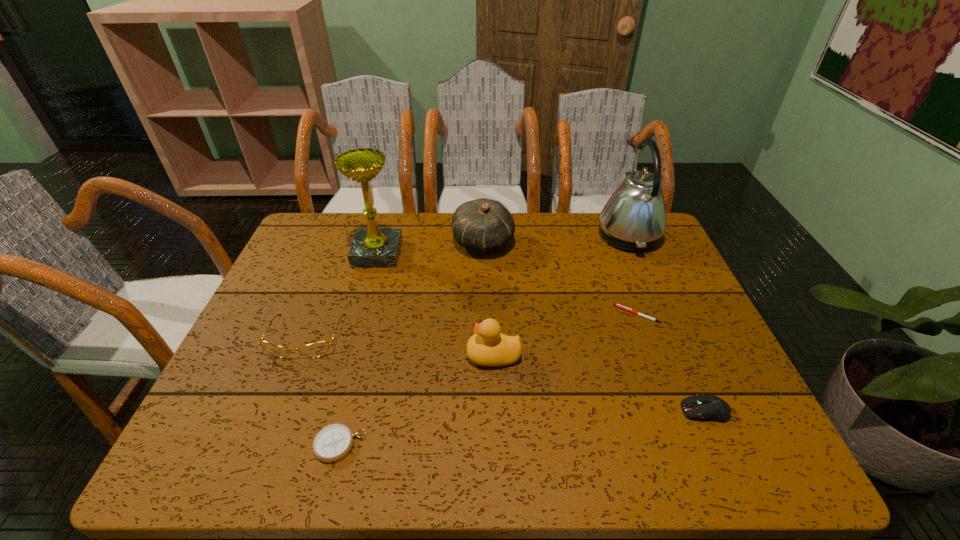
Identify the location of unoccupied position between the seventh tallest object and the seventh farthest object. This screenshot has height=540, width=960. (522, 428).

I want to click on free spot between the pen and the gourd, so click(x=560, y=279).

Where is `vacant area between the third tallest object and the fifth tallest object`? This screenshot has width=960, height=540. vacant area between the third tallest object and the fifth tallest object is located at coordinates (395, 290).

You are a GUI agent. You are given a task and a screenshot of the screen. Output one action in this format:
    pyautogui.click(x=<x>, y=<y>)
    Task: Click on the free space between the nearest object and the shortest object
    The image size is (960, 540).
    Given the screenshot: What is the action you would take?
    pyautogui.click(x=489, y=380)

Find the location of a particular element. free space that is in between the spectacles and the kettle is located at coordinates (467, 286).

Image resolution: width=960 pixels, height=540 pixels. I want to click on vacant space in between the third shortest object and the fourth shortest object, so click(506, 374).

You are a GUI agent. You are given a task and a screenshot of the screen. Output one action in this format:
    pyautogui.click(x=<x>, y=<y>)
    Task: Click on the free space between the award and the fifth tallest object
    
    Given the screenshot: What is the action you would take?
    pyautogui.click(x=342, y=295)

Identify the location of free space that is in between the gourd and the pen. [x=560, y=279].

Identify the location of vacant space that's between the gourd and the award. The width and height of the screenshot is (960, 540). (430, 248).

Identify which object is located as the seventh nearest to the kettle. Please provide its 2D coordinates. Your answer should be formatted as a tuple, i.e. [(x, y)], where the tuple contains the x and y coordinates of a point satisfying the conditions above.

[(332, 443)]